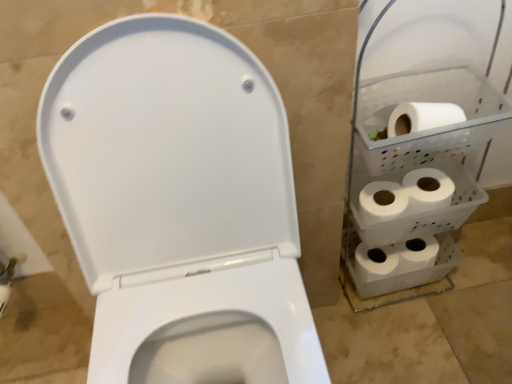
At what (x,y) coordinates should I click in order to perform the action: click on space that is in front of white plastic shelf at right. Please return your answer as a coordinate pair (x, y). Looking at the image, I should click on (416, 347).